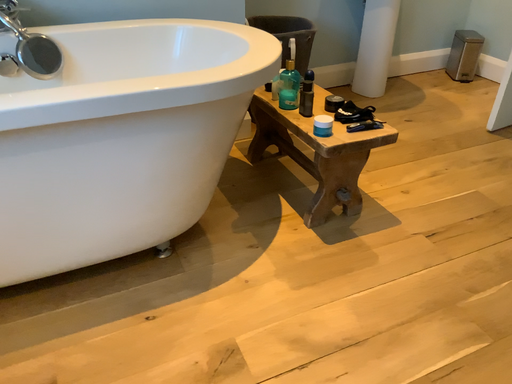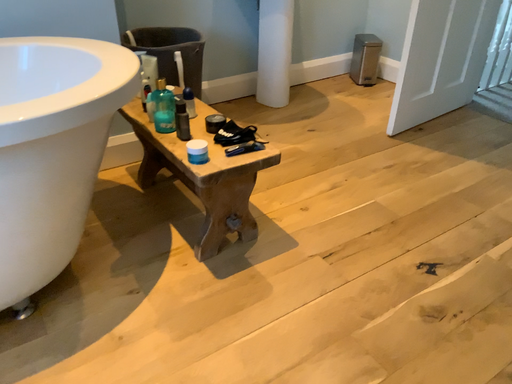
Question: Which way did the camera rotate in the video?

Choices:
 (A) rotated right
 (B) rotated left

Answer: (A)